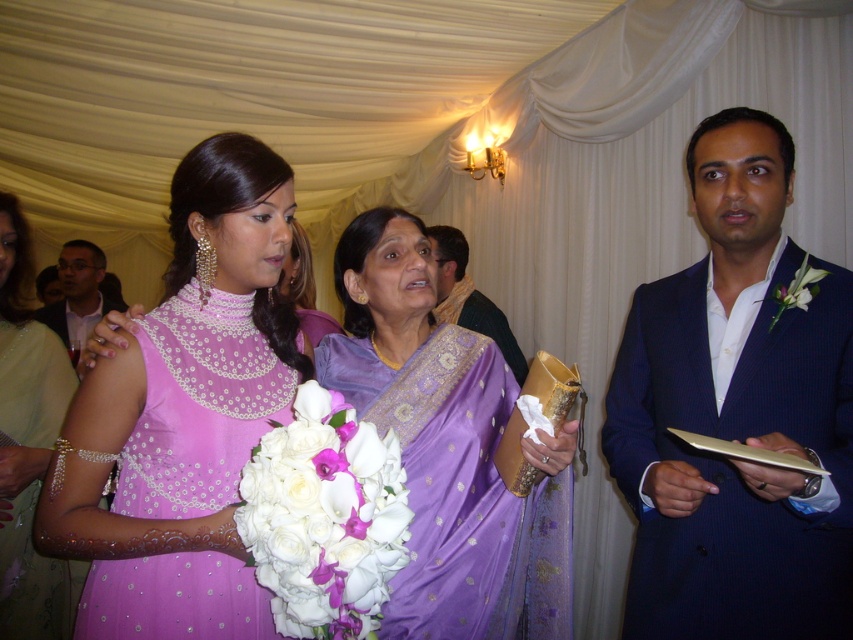
Consider the image. You are a photographer at this event and need to position the blue textured suit at right and the white silk bouquet at center in a group photo. Which object should be placed in the foreground to ensure proper focus and depth?

The blue textured suit at right should be placed in the foreground because it is much taller than the white silk bouquet at center, allowing for better depth and focus in the photograph.

You are a photographer at the event and need to capture a shot of both the blue textured suit at right and the white silk bouquet at center. Which object is closer to your camera position?

The blue textured suit at right is closer to the camera than the white silk bouquet at center because it is further to the viewer.

You are a photographer at this event and need to position the purple satin saree at center and the pink beaded dress at center so that both are visible in the frame. Given their heights, which one should you place closer to the camera to ensure both are fully visible?

The purple satin saree at center has a lesser height compared to the pink beaded dress at center. To ensure both are fully visible, the shorter purple satin saree at center should be placed closer to the camera while the taller pink beaded dress at center can be positioned slightly further back.